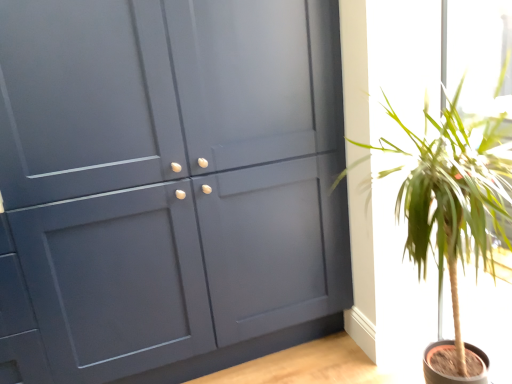
This screenshot has width=512, height=384. I want to click on matte gray cabinet at center, so click(167, 184).

This screenshot has height=384, width=512. What do you see at coordinates (167, 184) in the screenshot? I see `matte gray cabinet at center` at bounding box center [167, 184].

What do you see at coordinates (452, 198) in the screenshot?
I see `green leafy plant at right` at bounding box center [452, 198].

Locate an element on the screen. The width and height of the screenshot is (512, 384). green leafy plant at right is located at coordinates (452, 198).

The image size is (512, 384). Identify the location of matte gray cabinet at center. (167, 184).

Which is more to the left, green leafy plant at right or matte gray cabinet at center?

Positioned to the left is matte gray cabinet at center.

Based on the photo, is green leafy plant at right closer to the viewer compared to matte gray cabinet at center?

Yes, it is.

Is point (475, 250) farther from viewer compared to point (232, 221)?

No, it is not.

From the image's perspective, between green leafy plant at right and matte gray cabinet at center, who is located below?

green leafy plant at right is shown below in the image.

From a real-world perspective, is green leafy plant at right below matte gray cabinet at center?

Indeed, from a real-world perspective, green leafy plant at right is positioned beneath matte gray cabinet at center.

From the picture: Considering the relative sizes of green leafy plant at right and matte gray cabinet at center in the image provided, is green leafy plant at right thinner than matte gray cabinet at center?

Yes.

Can you confirm if green leafy plant at right is shorter than matte gray cabinet at center?

Yes.

Considering the sizes of objects green leafy plant at right and matte gray cabinet at center in the image provided, who is smaller, green leafy plant at right or matte gray cabinet at center?

green leafy plant at right.

Is green leafy plant at right not within matte gray cabinet at center?

Absolutely, green leafy plant at right is external to matte gray cabinet at center.

Can you see green leafy plant at right touching matte gray cabinet at center?

green leafy plant at right and matte gray cabinet at center are clearly separated.

Is green leafy plant at right facing away from matte gray cabinet at center?

green leafy plant at right does not have its back to matte gray cabinet at center.

How different are the orientations of green leafy plant at right and matte gray cabinet at center in degrees?

The facing directions of green leafy plant at right and matte gray cabinet at center are 90.2 degrees apart.

Locate an element on the screen. The image size is (512, 384). cupboard that is above the green leafy plant at right (from a real-world perspective) is located at coordinates (167, 184).

Is matte gray cabinet at center to the left or to the right of green leafy plant at right in the image?

matte gray cabinet at center is positioned on green leafy plant at right's left side.

Is matte gray cabinet at center positioned before green leafy plant at right?

No, it is behind green leafy plant at right.

Is point (323, 150) farther from camera compared to point (502, 72)?

Yes, point (323, 150) is farther from viewer.

From the image's perspective, is matte gray cabinet at center above or below green leafy plant at right?

matte gray cabinet at center is situated higher than green leafy plant at right in the image.

From a real-world perspective, is matte gray cabinet at center located higher than green leafy plant at right?

Yes, from a real-world perspective, matte gray cabinet at center is over green leafy plant at right

Is matte gray cabinet at center wider or thinner than green leafy plant at right?

Considering their sizes, matte gray cabinet at center looks broader than green leafy plant at right.

Can you confirm if matte gray cabinet at center is shorter than green leafy plant at right?

Incorrect, the height of matte gray cabinet at center does not fall short of that of green leafy plant at right.

Which of these two, matte gray cabinet at center or green leafy plant at right, is smaller?

With smaller size is green leafy plant at right.

Is matte gray cabinet at center situated inside green leafy plant at right or outside?

matte gray cabinet at center is not inside green leafy plant at right, it's outside.

Is matte gray cabinet at center directly adjacent to green leafy plant at right?

They are not placed beside each other.

Is matte gray cabinet at center oriented away from green leafy plant at right?

No, green leafy plant at right is not at the back of matte gray cabinet at center.

Based on the photo, what's the angular difference between matte gray cabinet at center and green leafy plant at right's facing directions?

matte gray cabinet at center and green leafy plant at right are facing 90.2 degrees away from each other.

Find the location of `cupboard located on the left of green leafy plant at right`. cupboard located on the left of green leafy plant at right is located at coordinates (167, 184).

Locate an element on the screen. houseplant in front of the matte gray cabinet at center is located at coordinates (452, 198).

This screenshot has height=384, width=512. What are the coordinates of `cupboard above the green leafy plant at right (from the image's perspective)` in the screenshot? It's located at (167, 184).